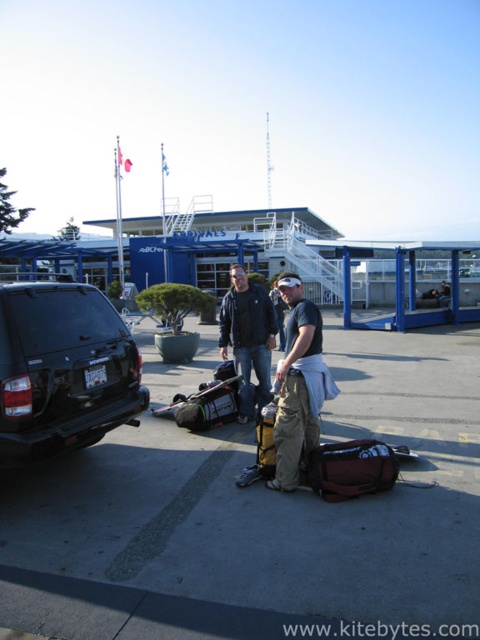
Who is taller, black rubber car at lower left or matte black jacket at center?

Standing taller between the two is matte black jacket at center.

Measure the distance between point (362, 552) and camera.

Point (362, 552) is 11.42 feet from camera.

Image resolution: width=480 pixels, height=640 pixels. I want to click on black rubber car at lower left, so click(259, 515).

Find the location of a particular element. black matte suv at left is located at coordinates (62, 369).

How distant is black matte suv at left from matte black jacket at center?

They are 2.09 meters apart.

Does point (69, 298) lie in front of point (242, 358)?

Yes, point (69, 298) is closer to viewer.

Identify the location of black matte suv at left. This screenshot has width=480, height=640. click(62, 369).

Looking at this image, is black rubber car at lower left below matte black shirt at center?

Yes, black rubber car at lower left is below matte black shirt at center.

Can you confirm if black rubber car at lower left is thinner than matte black shirt at center?

Yes, black rubber car at lower left is thinner than matte black shirt at center.

Image resolution: width=480 pixels, height=640 pixels. What do you see at coordinates (259, 515) in the screenshot?
I see `black rubber car at lower left` at bounding box center [259, 515].

The width and height of the screenshot is (480, 640). I want to click on black rubber car at lower left, so click(259, 515).